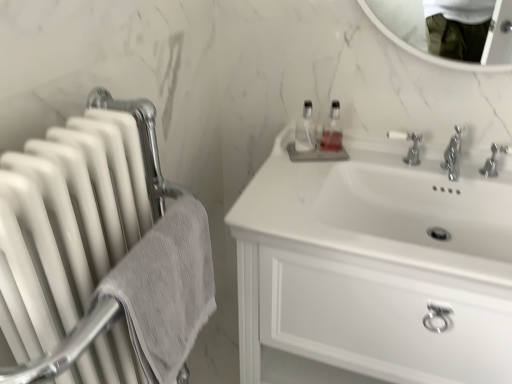
Locate an element on the screen. vacant region to the right of translucent plastic soap dispenser at upper center is located at coordinates (379, 152).